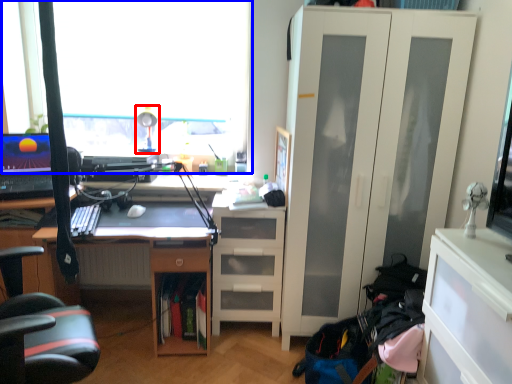
Question: Which object appears farthest to the camera in this image, table lamp (highlighted by a red box) or window (highlighted by a blue box)?

Choices:
 (A) table lamp
 (B) window

Answer: (B)